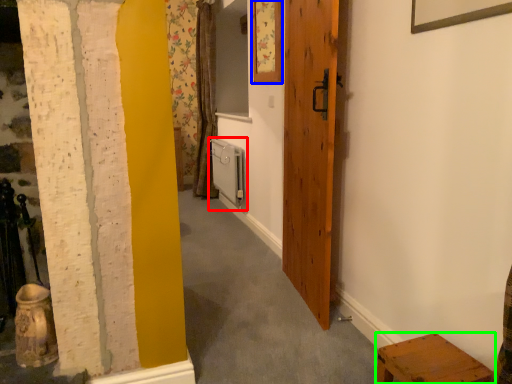
Question: Based on their relative distances, which object is nearer to radiator (highlighted by a red box)? Choose from picture frame (highlighted by a blue box) and furniture (highlighted by a green box).

Choices:
 (A) picture frame
 (B) furniture

Answer: (A)